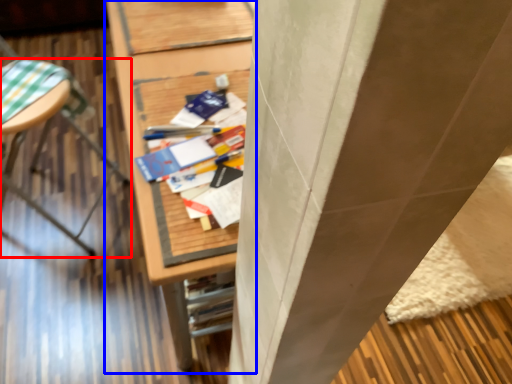
Question: Which object appears closest to the camera in this image, furniture (highlighted by a red box) or furniture (highlighted by a blue box)?

Choices:
 (A) furniture
 (B) furniture

Answer: (B)